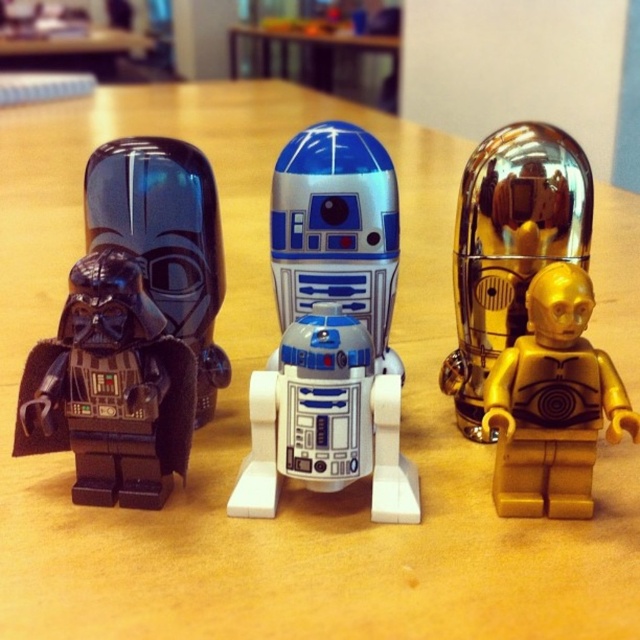
Question: Considering the real-world distances, which object is closest to the matte black minifigure at left?

Choices:
 (A) white plastic robot at center
 (B) gold metallic figure at right
 (C) wooden table at center

Answer: (A)

Question: Can you confirm if matte black minifigure at left is positioned above white plastic robot at center?

Choices:
 (A) yes
 (B) no

Answer: (A)

Question: Among these objects, which one is farthest from the camera?

Choices:
 (A) matte black minifigure at left
 (B) wooden table at center

Answer: (B)

Question: Is matte black helmet at left positioned before wooden table at center?

Choices:
 (A) yes
 (B) no

Answer: (A)

Question: Does matte black minifigure at left have a lesser width compared to metallic blue and silver robot at center?

Choices:
 (A) yes
 (B) no

Answer: (B)

Question: Which object is the farthest from the matte black helmet at left?

Choices:
 (A) matte black minifigure at left
 (B) metallic blue and silver robot at center
 (C) gold reflective dome at center
 (D) gold metallic figure at right

Answer: (D)